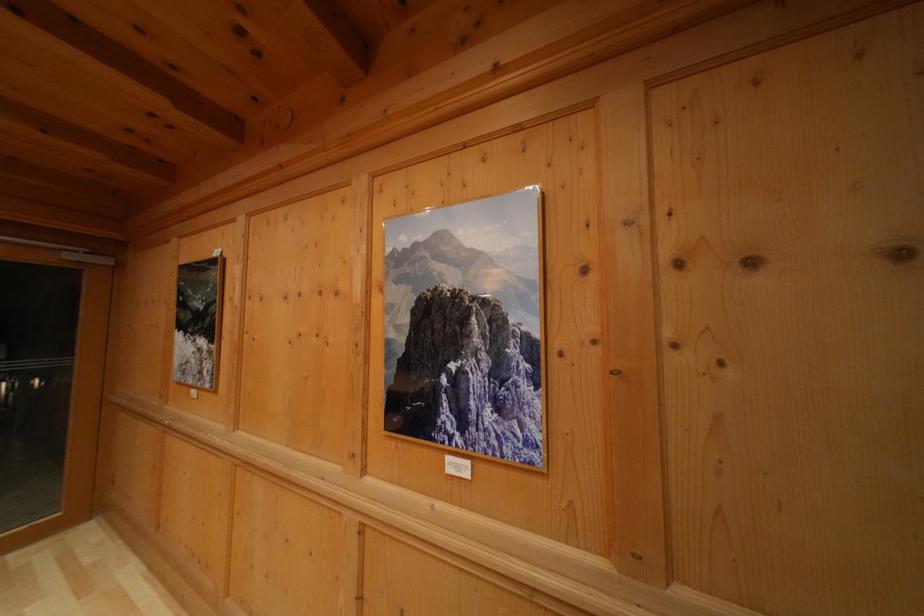
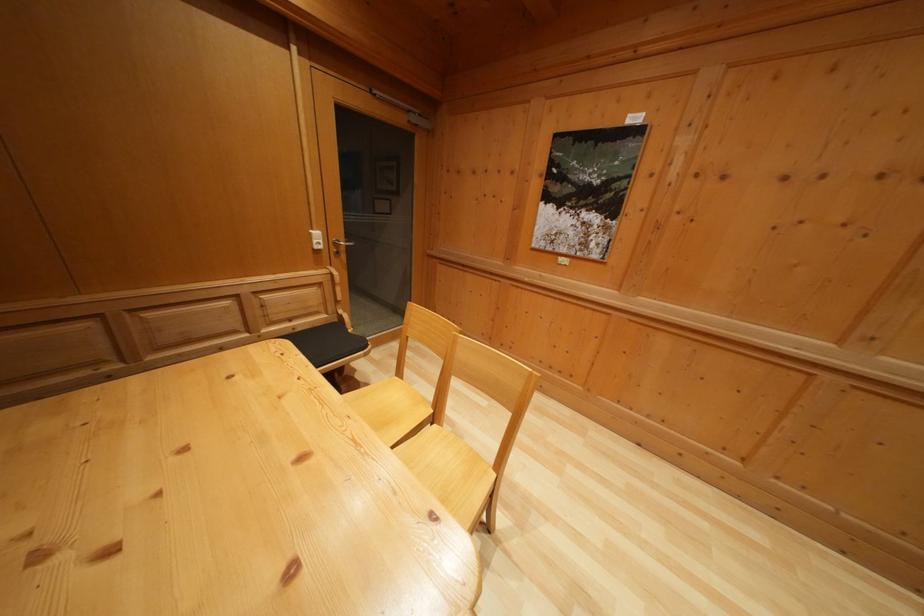
Question: In a continuous first-person perspective shot, in which direction is the camera moving?

Choices:
 (A) Left
 (B) Right
 (C) Forward
 (D) Backward

Answer: (A)